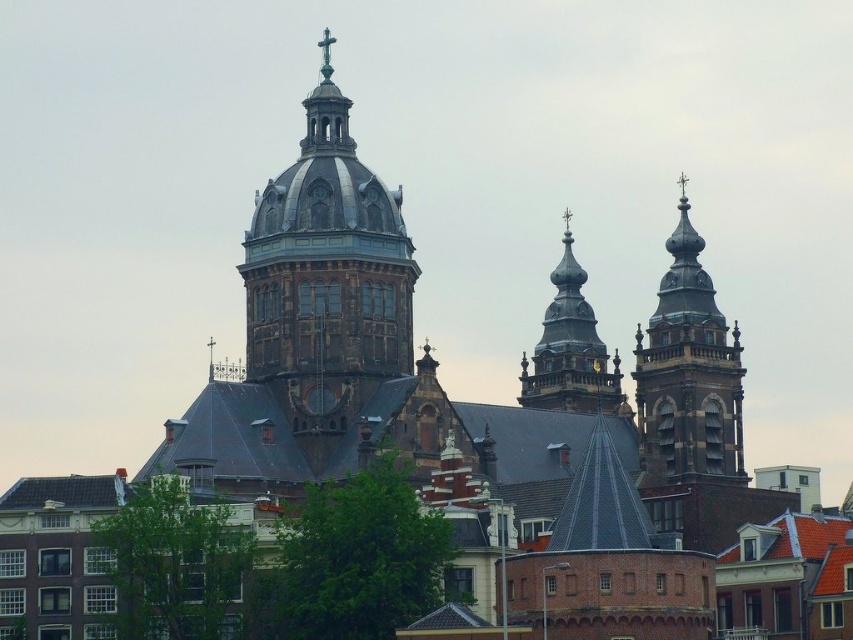
You are standing in front of the historic church complex and want to determine which of the two points, point (296, 330) or point (556, 284), is closer to you. Based on the scene description, which point is nearer?

Point (296, 330) is closer to the viewer than point (556, 284) according to the description.

You are standing in front of the historic church complex and want to take a photo of the dark brown stone tower at center and the polished stone spire at upper right. Which object will appear larger in your photo?

The dark brown stone tower at center will appear larger in your photo because it is closer to you than the polished stone spire at upper right.

Looking at this image, you are standing in front of the historic church complex and want to determine the relative positions of two points marked on the image. Which point is closer to your viewpoint? The points are labeled as point 1 at coordinates (665,342) and point 2 at coordinates (548,332). Please answer based on the spatial relationship between them.

Point 1 at coordinates (665,342) is closer to the viewer than point 2 at coordinates (548,332).